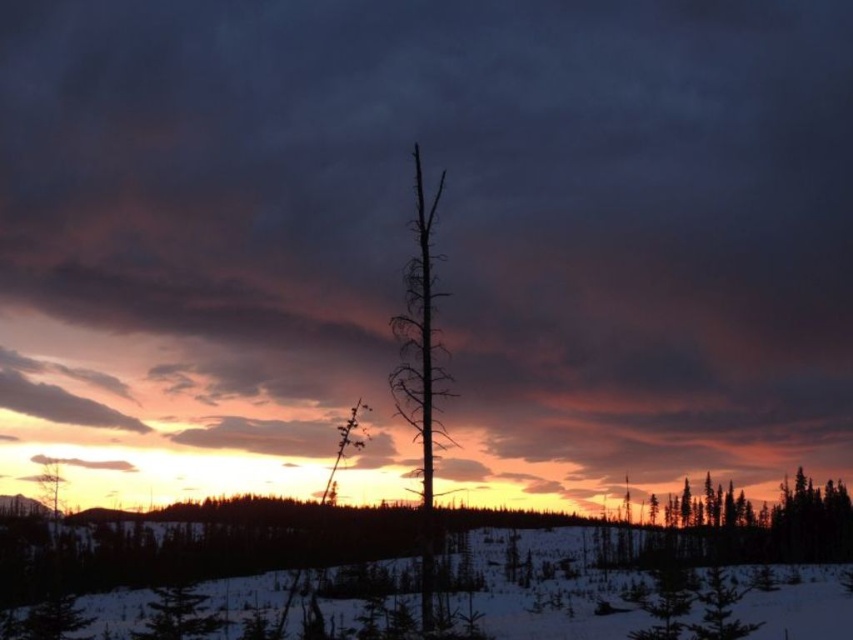
Question: Which point is closer to the camera?

Choices:
 (A) silvery metallic tree at center
 (B) smooth brown tree trunk at lower left
 (C) green matte tree at center

Answer: (A)

Question: Which of the following is the closest to the observer?

Choices:
 (A) silhouette deadwood at center
 (B) smooth brown tree trunk at lower left

Answer: (A)

Question: Is green matte tree at center wider than smooth brown tree trunk at lower left?

Choices:
 (A) no
 (B) yes

Answer: (B)

Question: Can you confirm if green matte tree at center is positioned to the left of smooth brown tree trunk at lower left?

Choices:
 (A) no
 (B) yes

Answer: (A)

Question: Estimate the real-world distances between objects in this image. Which object is farther from the smooth brown tree trunk at lower left?

Choices:
 (A) silhouette deadwood at center
 (B) white powdery snow at lower center
 (C) silvery metallic tree at center

Answer: (A)

Question: From the image, what is the correct spatial relationship of white powdery snow at lower center in relation to silvery metallic tree at center?

Choices:
 (A) left
 (B) right

Answer: (B)